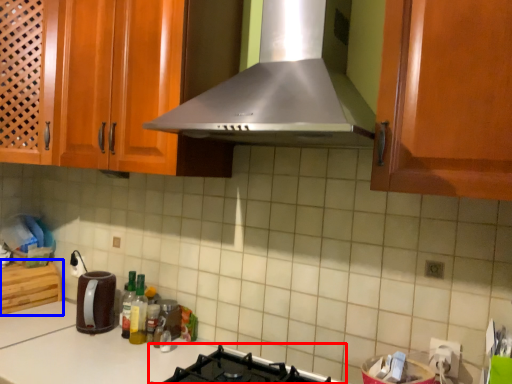
Question: Which object is further to the camera taking this photo, gas stove (highlighted by a red box) or cabinetry (highlighted by a blue box)?

Choices:
 (A) gas stove
 (B) cabinetry

Answer: (B)